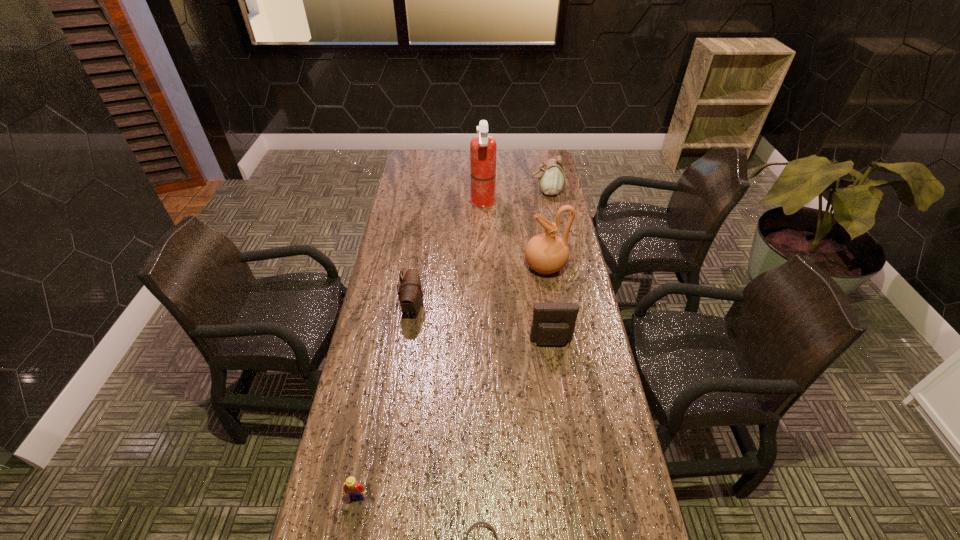
I want to click on the tallest object, so click(x=483, y=147).

I want to click on the second tallest object, so click(x=546, y=253).

This screenshot has height=540, width=960. I want to click on pottery, so click(x=546, y=253).

The height and width of the screenshot is (540, 960). What are the coordinates of `the farthest pouch` in the screenshot? It's located at coord(551,178).

Locate an element on the screen. the fifth farthest object is located at coordinates (553, 323).

Identify the location of the fourth farthest object. (410, 293).

I want to click on the leftmost pouch, so click(x=410, y=293).

You are a GUI agent. You are given a task and a screenshot of the screen. Output one action in this format:
    pyautogui.click(x=<x>, y=<y>)
    Task: Click on the sixth tallest object
    The height and width of the screenshot is (540, 960).
    Given the screenshot: What is the action you would take?
    pyautogui.click(x=352, y=487)

Where is `the sixth farthest object`? Image resolution: width=960 pixels, height=540 pixels. the sixth farthest object is located at coordinates (352, 487).

Where is `vacant point located 0.130m with the handle and hose on the fire extinguisher`? This screenshot has width=960, height=540. vacant point located 0.130m with the handle and hose on the fire extinguisher is located at coordinates (441, 202).